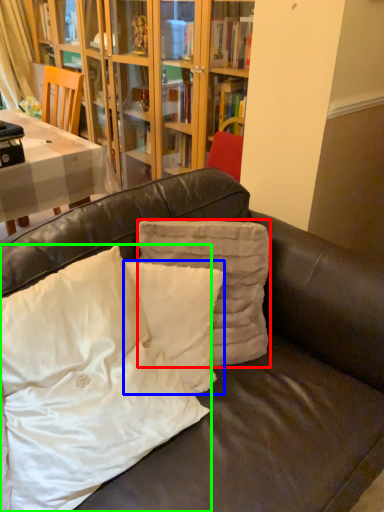
Question: Which object is positioned farthest from pillow (highlighted by a red box)? Select from pillow (highlighted by a blue box) and pillow (highlighted by a green box).

Choices:
 (A) pillow
 (B) pillow

Answer: (B)